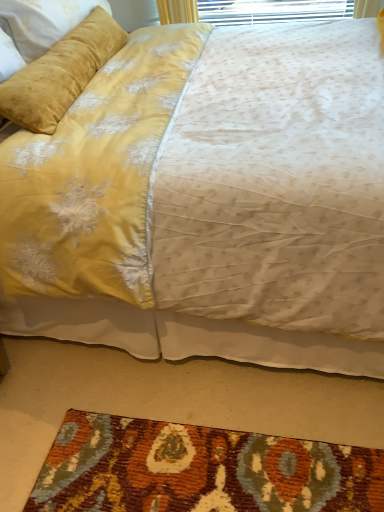
Question: Is velvet yellow pillow at upper left next to velvet yellow bed at upper center and touching it?

Choices:
 (A) yes
 (B) no

Answer: (B)

Question: Can you confirm if velvet yellow pillow at upper left is taller than velvet yellow bed at upper center?

Choices:
 (A) no
 (B) yes

Answer: (A)

Question: Considering the relative positions of velvet yellow pillow at upper left and velvet yellow bed at upper center in the image provided, is velvet yellow pillow at upper left to the left of velvet yellow bed at upper center from the viewer's perspective?

Choices:
 (A) yes
 (B) no

Answer: (A)

Question: Is velvet yellow bed at upper center inside velvet yellow pillow at upper left?

Choices:
 (A) yes
 (B) no

Answer: (B)

Question: Is velvet yellow pillow at upper left shorter than velvet yellow bed at upper center?

Choices:
 (A) no
 (B) yes

Answer: (B)

Question: Is velvet yellow pillow at upper left wider or thinner than velvet yellow bed at upper center?

Choices:
 (A) thin
 (B) wide

Answer: (A)

Question: From a real-world perspective, is velvet yellow pillow at upper left positioned above or below velvet yellow bed at upper center?

Choices:
 (A) above
 (B) below

Answer: (A)

Question: Is velvet yellow pillow at upper left inside the boundaries of velvet yellow bed at upper center, or outside?

Choices:
 (A) outside
 (B) inside

Answer: (B)

Question: Looking at the image, does velvet yellow pillow at upper left seem bigger or smaller compared to velvet yellow bed at upper center?

Choices:
 (A) small
 (B) big

Answer: (A)

Question: From a real-world perspective, is textured wool mat at lower center above or below velvet yellow bed at upper center?

Choices:
 (A) below
 (B) above

Answer: (A)

Question: Based on their sizes in the image, would you say textured wool mat at lower center is bigger or smaller than velvet yellow bed at upper center?

Choices:
 (A) big
 (B) small

Answer: (B)

Question: In the image, is textured wool mat at lower center on the left side or the right side of velvet yellow bed at upper center?

Choices:
 (A) left
 (B) right

Answer: (A)

Question: Considering the positions of point (309, 500) and point (59, 252), is point (309, 500) closer or farther from the camera than point (59, 252)?

Choices:
 (A) closer
 (B) farther

Answer: (A)

Question: Does point (195, 69) appear closer or farther from the camera than point (41, 130)?

Choices:
 (A) closer
 (B) farther

Answer: (B)

Question: From the image's perspective, is velvet yellow bed at upper center above or below velvet yellow pillow at upper left?

Choices:
 (A) above
 (B) below

Answer: (B)